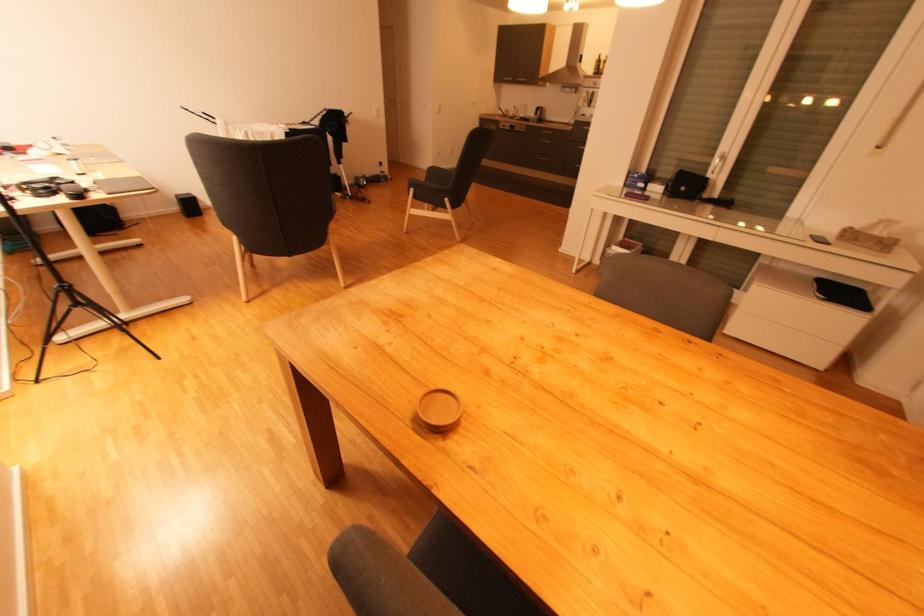
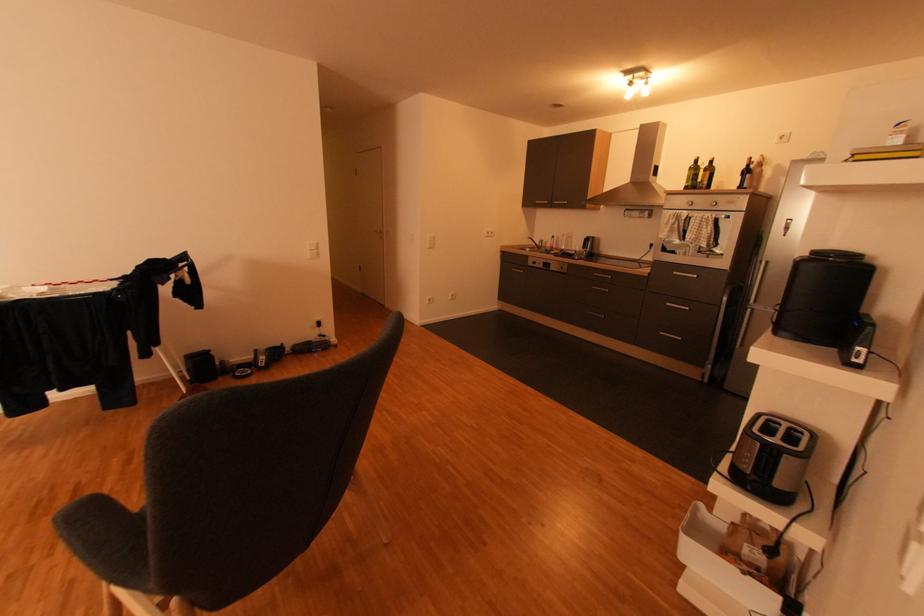
Question: What movement of the cameraman would produce the second image?

Choices:
 (A) Left
 (B) Right
 (C) Forward
 (D) Backward

Answer: (C)